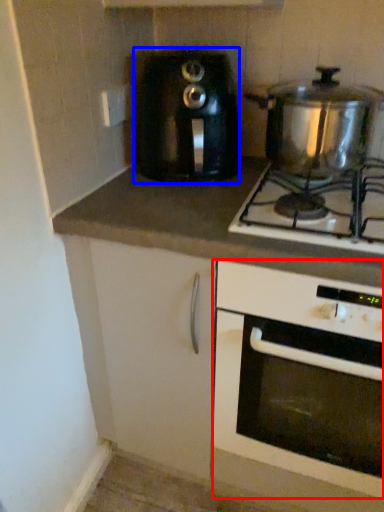
Question: Which object appears farthest to the camera in this image, oven (highlighted by a red box) or toaster (highlighted by a blue box)?

Choices:
 (A) oven
 (B) toaster

Answer: (B)